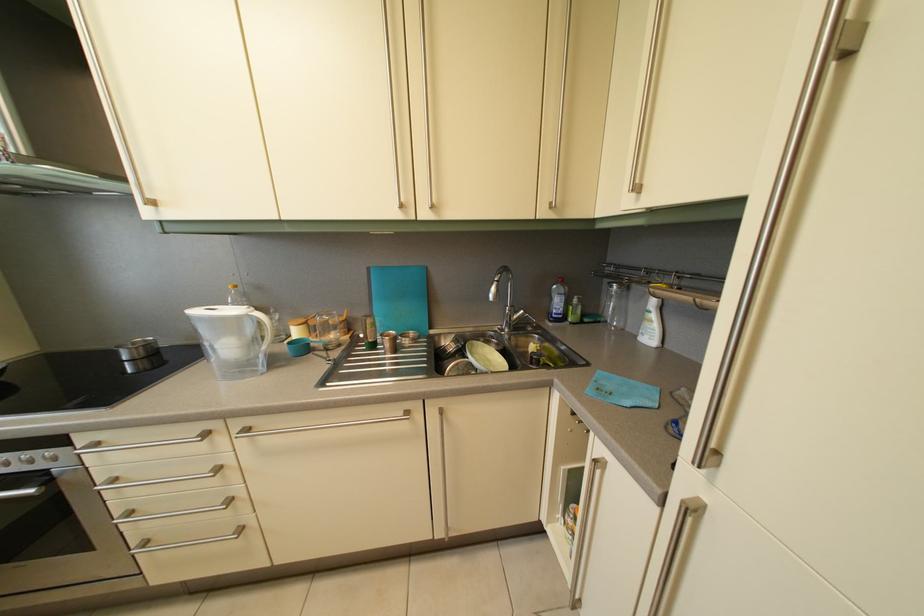
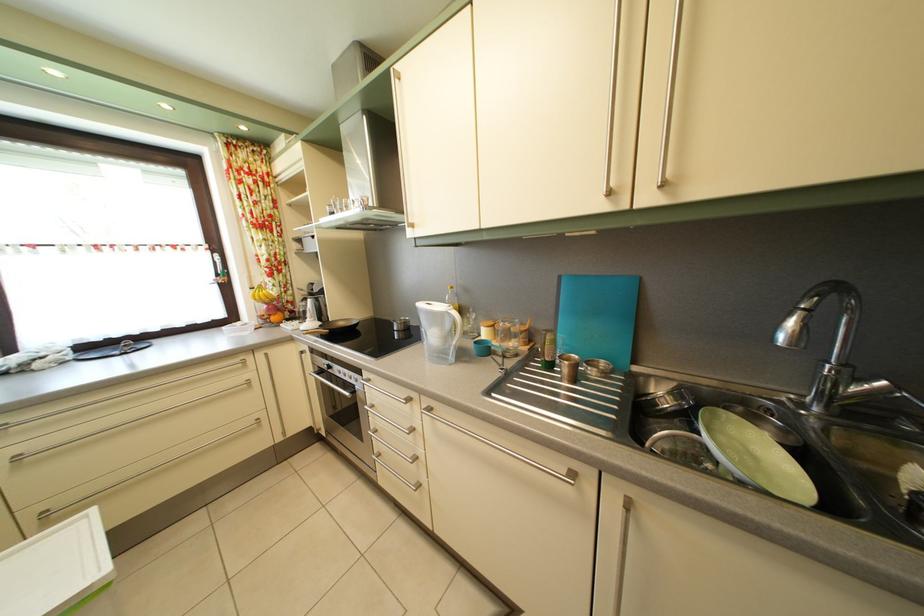
In the second image, find the point that corresponds to the point at 395,352 in the first image.

(574, 378)